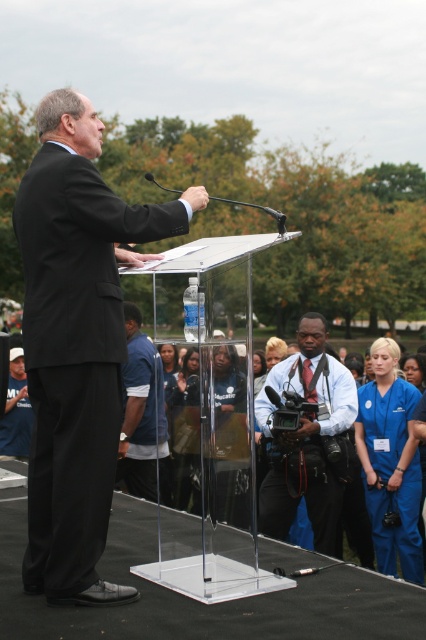
You are an event planner checking the speaker attire for a formal event. The speaker is wearing a matte black suit at center and a blue shirt at center. Which item of clothing has a greater width?

The matte black suit at center has a greater width than the blue shirt at center.

You are standing at the origin point of the coordinate system in the image. The speaker is wearing a matte black suit at center. If you want to walk directly towards the speaker, in which direction should you move? Please specify the direction using the coordinate system provided in the Objects Description.

To walk directly towards the matte black suit at center located at coordinate point (77,342), you should move towards the positive x and positive y direction since the speaker is positioned at higher x and y values compared to the origin point at (0,0).